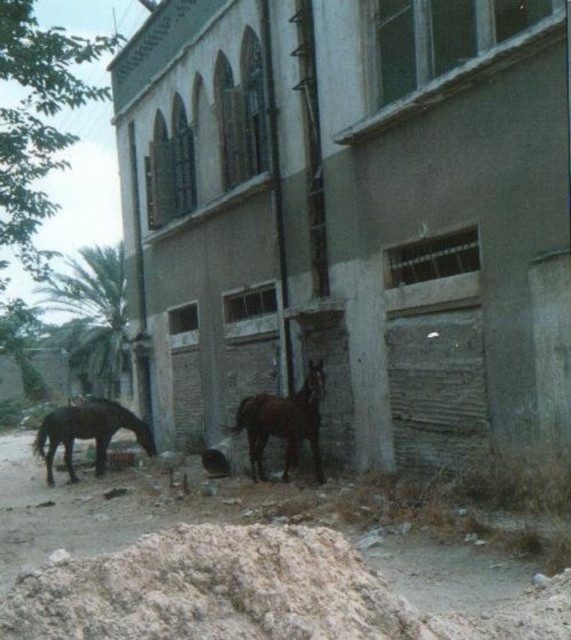
You are a photographer standing in front of the building. You want to take a photo that includes both the brown glossy horse at center and the shiny dark brown horse at lower left. Which horse should you position closer to the left side of your camera frame to ensure both are visible?

To ensure both the brown glossy horse at center and the shiny dark brown horse at lower left are visible, position the shiny dark brown horse at lower left closer to the left side of your camera frame since it is already located to the left of the brown glossy horse at center.

You are a delivery person trying to park your van near the brown glossy horse at center. The van requires a flat, clear space. Based on the scene, can you park the van on the brown dirt at lower center?

The brown dirt at lower center is below the brown glossy horse at center, meaning it is occupied by the horse. Therefore, you cannot park the van there as the space is not clear.

You are standing at the entrance of the building and want to walk to the brown dirt at lower center. Which direction should you head towards?

Since the brown dirt at lower center is located at point 0.900 on the x axis and 0.426 on the y axis, you should head towards the lower center direction from the entrance to reach it.